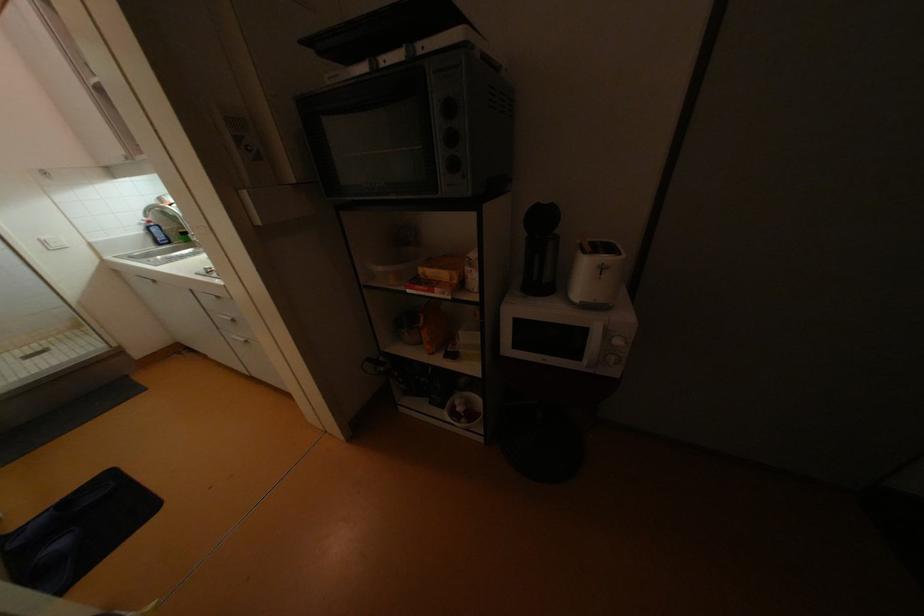
Identify the location of black electric kettle. (541, 249).